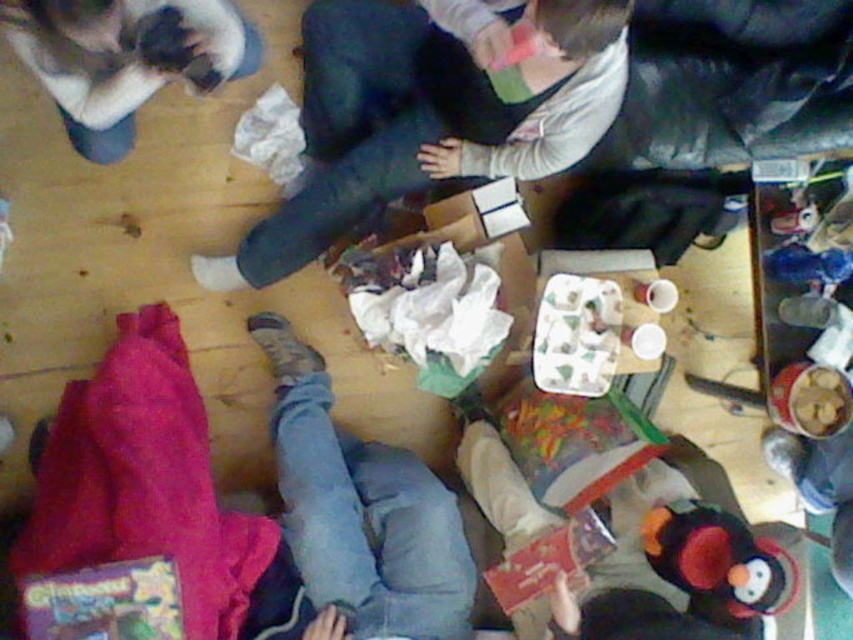
Looking at this image, who is taller, dark blue jeans at center or fluffy white cat at upper left?

With more height is dark blue jeans at center.

Does dark blue jeans at center come behind fluffy white cat at upper left?

No, dark blue jeans at center is in front of fluffy white cat at upper left.

Who is more distant from viewer, (556, 17) or (155, 77)?

Positioned behind is point (155, 77).

The image size is (853, 640). I want to click on dark blue jeans at center, so click(428, 113).

From the picture: Can you confirm if dark blue jeans at center is positioned to the left of fluffy plush penguin at lower right?

Indeed, dark blue jeans at center is positioned on the left side of fluffy plush penguin at lower right.

Which is below, dark blue jeans at center or fluffy plush penguin at lower right?

fluffy plush penguin at lower right is below.

Is point (410, 29) positioned behind point (672, 547)?

Yes, point (410, 29) is farther from viewer.

Locate an element on the screen. The image size is (853, 640). dark blue jeans at center is located at coordinates tap(428, 113).

Is dark blue jeans at center to the left of jeans at center from the viewer's perspective?

In fact, dark blue jeans at center is to the right of jeans at center.

I want to click on dark blue jeans at center, so click(x=428, y=113).